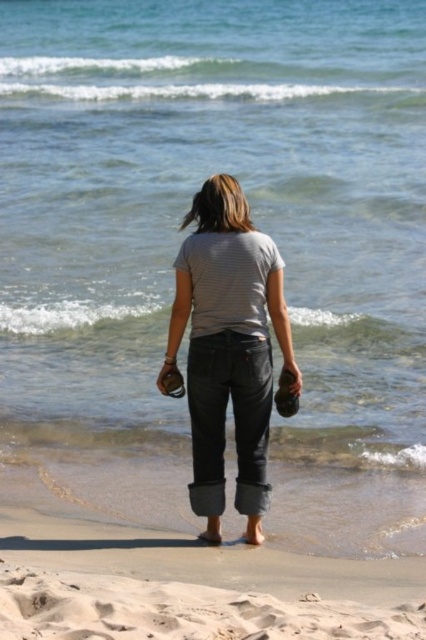
Measure the distance between gray cotton shirt at center and camera.

A distance of 10.61 meters exists between gray cotton shirt at center and camera.

Does gray cotton shirt at center appear on the left side of sandy beach at lower center?

In fact, gray cotton shirt at center is to the right of sandy beach at lower center.

The width and height of the screenshot is (426, 640). I want to click on gray cotton shirt at center, so click(x=229, y=348).

At what (x,y) coordinates should I click in order to perform the action: click on gray cotton shirt at center. Please return your answer as a coordinate pair (x, y). This screenshot has height=640, width=426. Looking at the image, I should click on (229, 348).